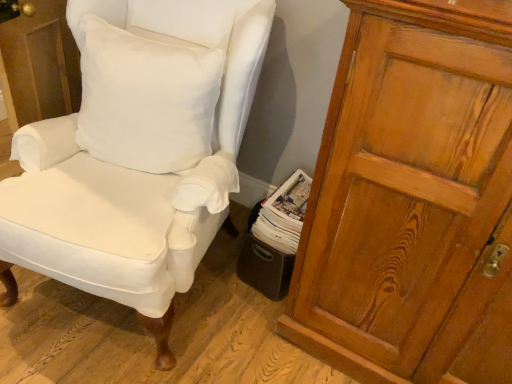
Question: Considering the positions of wooden cupboard at right and white paper magazine at lower center in the image, is wooden cupboard at right bigger or smaller than white paper magazine at lower center?

Choices:
 (A) small
 (B) big

Answer: (B)

Question: Choose the correct answer: Is wooden cupboard at right inside white paper magazine at lower center or outside it?

Choices:
 (A) inside
 (B) outside

Answer: (B)

Question: Which object is the closest to the wooden cupboard at right?

Choices:
 (A) white fabric chair at center
 (B) white paper magazine at lower center
 (C) white cotton pillow at upper left

Answer: (B)

Question: Which of these objects is positioned farthest from the wooden cupboard at right?

Choices:
 (A) white fabric chair at center
 (B) white cotton pillow at upper left
 (C) white paper magazine at lower center

Answer: (B)